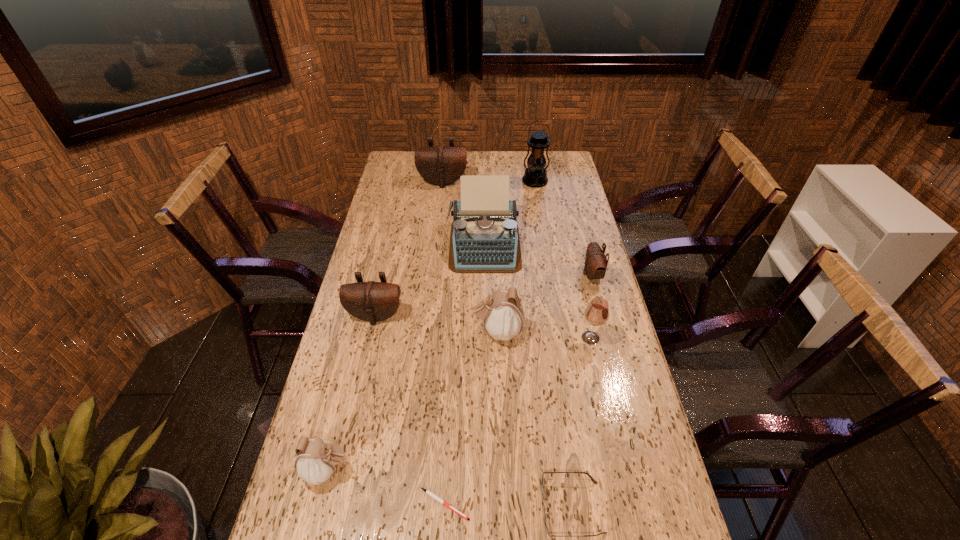
Where is `lantern`? The width and height of the screenshot is (960, 540). lantern is located at coordinates (535, 175).

Find the location of `black lantern`. black lantern is located at coordinates (535, 175).

At what (x,y) coordinates should I click in order to perform the action: click on typewriter. Please return your answer as a coordinate pair (x, y). Looking at the image, I should click on (484, 238).

I want to click on the farthest pouch, so click(x=440, y=165).

Where is `the farthest brown pouch`? the farthest brown pouch is located at coordinates (440, 165).

Locate an element on the screen. the farther white pouch is located at coordinates (503, 318).

Image resolution: width=960 pixels, height=540 pixels. Identify the location of the second pouch from right to left. click(503, 318).

At what (x,y) coordinates should I click in order to perform the action: click on the nearest brown pouch. Please return your answer as a coordinate pair (x, y). The image size is (960, 540). Looking at the image, I should click on (371, 301).

The image size is (960, 540). I want to click on wineglass, so click(596, 313).

This screenshot has width=960, height=540. In order to click on the nearest pouch in this screenshot , I will do `click(316, 460)`.